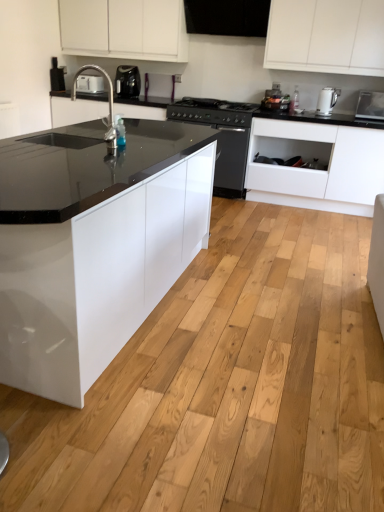
Question: Can you confirm if white glossy electric kettle at upper right, which is the second kitchen appliance in top-to-bottom order, is wider than transparent plastic bottle at center?

Choices:
 (A) no
 (B) yes

Answer: (B)

Question: Is white glossy electric kettle at upper right, which appears as the 1th kitchen appliance when viewed from the right, surrounding transparent plastic bottle at center?

Choices:
 (A) yes
 (B) no

Answer: (B)

Question: Is white glossy electric kettle at upper right, marked as the 2th kitchen appliance in a back-to-front arrangement, positioned far away from transparent plastic bottle at center?

Choices:
 (A) no
 (B) yes

Answer: (A)

Question: Does white glossy electric kettle at upper right, which is the 1th kitchen appliance in bottom-to-top order, lie in front of transparent plastic bottle at center?

Choices:
 (A) no
 (B) yes

Answer: (B)

Question: Can you confirm if white glossy electric kettle at upper right, which is the second kitchen appliance in top-to-bottom order, is positioned to the left of transparent plastic bottle at center?

Choices:
 (A) yes
 (B) no

Answer: (B)

Question: In terms of size, does white glossy electric kettle at upper right, which appears as the 1th kitchen appliance when viewed from the right, appear bigger or smaller than white plastic toaster at upper left, placed as the 2th appliance when sorted from front to back?

Choices:
 (A) small
 (B) big

Answer: (A)

Question: Is white glossy electric kettle at upper right, the first kitchen appliance in the front-to-back sequence, taller or shorter than white plastic toaster at upper left, marked as the 2th appliance in a right-to-left arrangement?

Choices:
 (A) short
 (B) tall

Answer: (B)

Question: From a real-world perspective, is white glossy electric kettle at upper right, which is the 1th kitchen appliance in bottom-to-top order, physically located above or below white plastic toaster at upper left, which is counted as the 1th appliance, starting from the top?

Choices:
 (A) below
 (B) above

Answer: (B)

Question: From the image's perspective, is white glossy electric kettle at upper right, marked as the 2th kitchen appliance in a back-to-front arrangement, located above or below white plastic toaster at upper left, marked as the 1th appliance in a left-to-right arrangement?

Choices:
 (A) above
 (B) below

Answer: (B)

Question: Does point (294, 104) appear closer or farther from the camera than point (67, 25)?

Choices:
 (A) closer
 (B) farther

Answer: (A)

Question: Considering their positions, is transparent plastic bottle at center located in front of or behind white glossy cabinet at upper center, which ranks as the first cabinetry in left-to-right order?

Choices:
 (A) behind
 (B) front

Answer: (A)

Question: From the image's perspective, is transparent plastic bottle at center positioned above or below white glossy cabinet at upper center, positioned as the 2th cabinetry in right-to-left order?

Choices:
 (A) above
 (B) below

Answer: (B)

Question: Is transparent plastic bottle at center to the left or to the right of white glossy cabinet at upper center, placed as the 1th cabinetry when sorted from top to bottom, in the image?

Choices:
 (A) right
 (B) left

Answer: (A)

Question: Is black matte stove at center situated inside white glossy electric kettle at upper right, which is the second kitchen appliance in top-to-bottom order, or outside?

Choices:
 (A) inside
 (B) outside

Answer: (B)

Question: In terms of size, does black matte stove at center appear bigger or smaller than white glossy electric kettle at upper right, which is the 1th kitchen appliance in bottom-to-top order?

Choices:
 (A) big
 (B) small

Answer: (A)